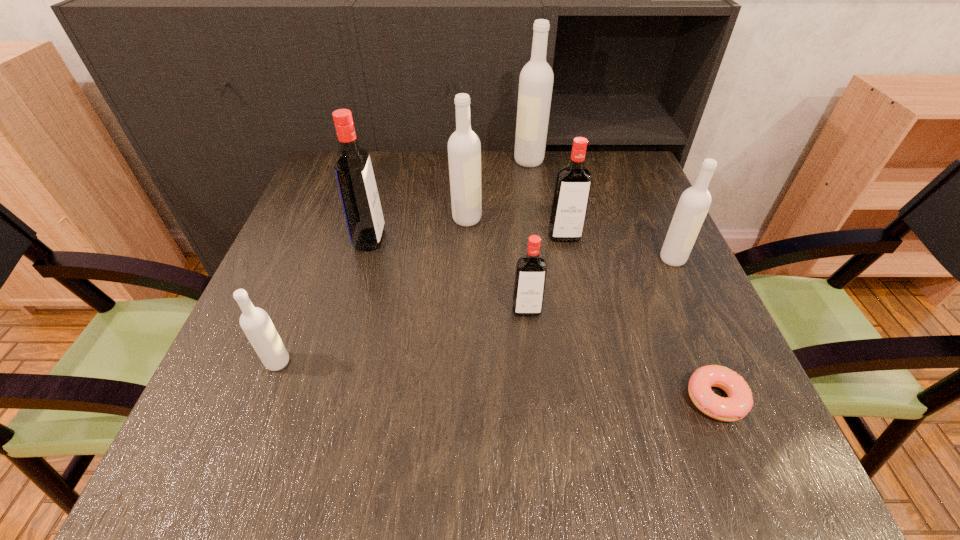
Locate an element on the screen. Image resolution: width=960 pixels, height=540 pixels. the tallest vodka is located at coordinates (536, 79).

This screenshot has height=540, width=960. Identify the location of the farthest white vodka. (536, 79).

The width and height of the screenshot is (960, 540). Identify the location of the leftmost red vodka. (357, 186).

I want to click on the second object from left to right, so click(x=357, y=186).

The image size is (960, 540). Identify the location of the third nearest white vodka. pos(464,148).

Identify the location of the third vodka from left to right. (464, 148).

The image size is (960, 540). Identify the location of the rightmost vodka. (694, 203).

Find the location of a particular element. The width and height of the screenshot is (960, 540). the third farthest white vodka is located at coordinates (694, 203).

Locate an element on the screen. The height and width of the screenshot is (540, 960). the second smallest red vodka is located at coordinates (573, 183).

Find the location of `the smallest red vodka`. the smallest red vodka is located at coordinates (531, 269).